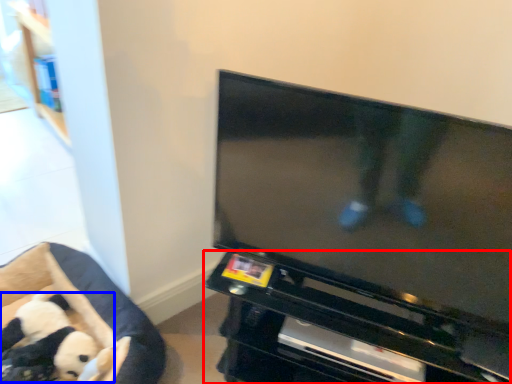
Question: Which of the following is the farthest to the observer, entertainment center (highlighted by a red box) or toy (highlighted by a blue box)?

Choices:
 (A) entertainment center
 (B) toy

Answer: (B)